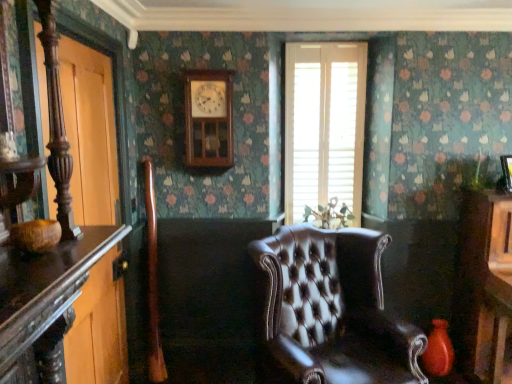
Question: Is wooden clock at upper center not close to matte red vase at lower right?

Choices:
 (A) yes
 (B) no

Answer: (A)

Question: Considering the relative sizes of wooden clock at upper center and matte red vase at lower right in the image provided, is wooden clock at upper center smaller than matte red vase at lower right?

Choices:
 (A) yes
 (B) no

Answer: (B)

Question: Is wooden clock at upper center taller than matte red vase at lower right?

Choices:
 (A) yes
 (B) no

Answer: (A)

Question: Does wooden clock at upper center appear on the right side of matte red vase at lower right?

Choices:
 (A) yes
 (B) no

Answer: (B)

Question: From a real-world perspective, does wooden clock at upper center sit lower than matte red vase at lower right?

Choices:
 (A) yes
 (B) no

Answer: (B)

Question: Is wooden clock at upper center shorter than matte red vase at lower right?

Choices:
 (A) no
 (B) yes

Answer: (A)

Question: Considering the relative positions of white wood blinds at center and brown leather chair at center in the image provided, is white wood blinds at center behind brown leather chair at center?

Choices:
 (A) no
 (B) yes

Answer: (B)

Question: From the image's perspective, does white wood blinds at center appear higher than brown leather chair at center?

Choices:
 (A) no
 (B) yes

Answer: (B)

Question: Can you confirm if white wood blinds at center is shorter than brown leather chair at center?

Choices:
 (A) no
 (B) yes

Answer: (A)

Question: Is white wood blinds at center closer to camera compared to brown leather chair at center?

Choices:
 (A) yes
 (B) no

Answer: (B)

Question: Considering the relative sizes of white wood blinds at center and brown leather chair at center in the image provided, is white wood blinds at center wider than brown leather chair at center?

Choices:
 (A) no
 (B) yes

Answer: (A)

Question: Is white wood blinds at center far away from brown leather chair at center?

Choices:
 (A) yes
 (B) no

Answer: (B)

Question: Is brown leather chair at center aimed at white wood blinds at center?

Choices:
 (A) yes
 (B) no

Answer: (B)